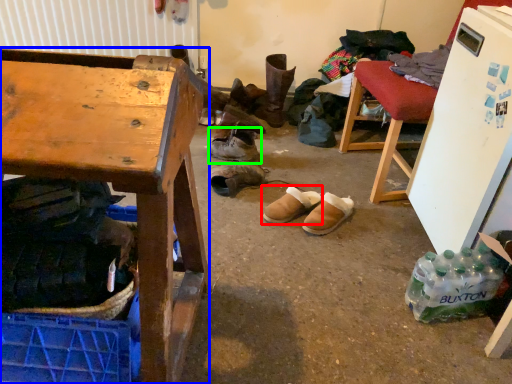
Question: Which object is the farthest from footwear (highlighted by a red box)? Choose among these: desk (highlighted by a blue box) or footwear (highlighted by a green box).

Choices:
 (A) desk
 (B) footwear

Answer: (A)